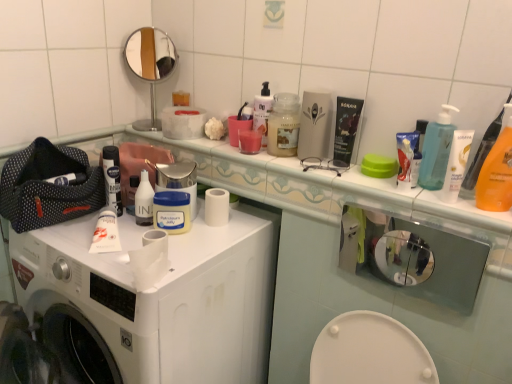
Locate an element on the screen. The width and height of the screenshot is (512, 384). free space to the left of white plastic container at upper right, which ranks as the second product in left-to-right order is located at coordinates (343, 176).